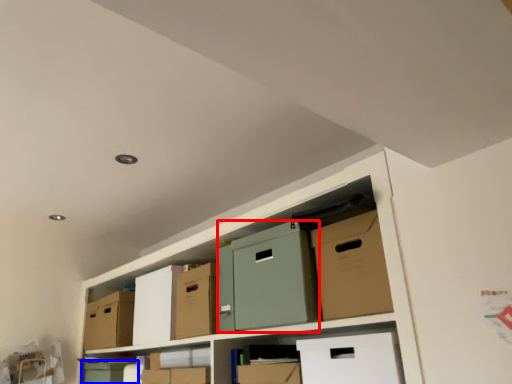
Question: Among these objects, which one is farthest to the camera, wide (highlighted by a red box) or box (highlighted by a blue box)?

Choices:
 (A) wide
 (B) box

Answer: (B)